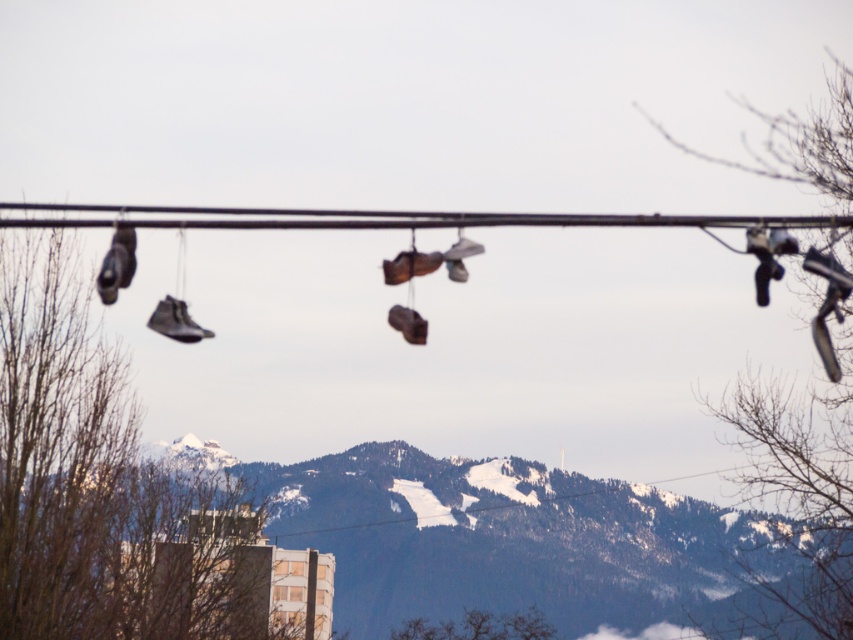
Question: Which object is positioned farthest from the snowy forested mountain at center?

Choices:
 (A) matte black shoe at left
 (B) matte black sneaker at center

Answer: (B)

Question: Which is nearer to the snowy forested mountain at center?

Choices:
 (A) matte black shoe at left
 (B) matte black sneaker at center

Answer: (A)

Question: Does snowy forested mountain at center appear on the right side of matte black sneaker at center?

Choices:
 (A) no
 (B) yes

Answer: (B)

Question: Can you confirm if matte black shoe at left is wider than matte black sneaker at center?

Choices:
 (A) yes
 (B) no

Answer: (B)

Question: Which of the following is the farthest from the observer?

Choices:
 (A) matte black sneaker at center
 (B) snowy forested mountain at center

Answer: (A)

Question: Is snowy forested mountain at center behind matte black sneaker at center?

Choices:
 (A) no
 (B) yes

Answer: (A)